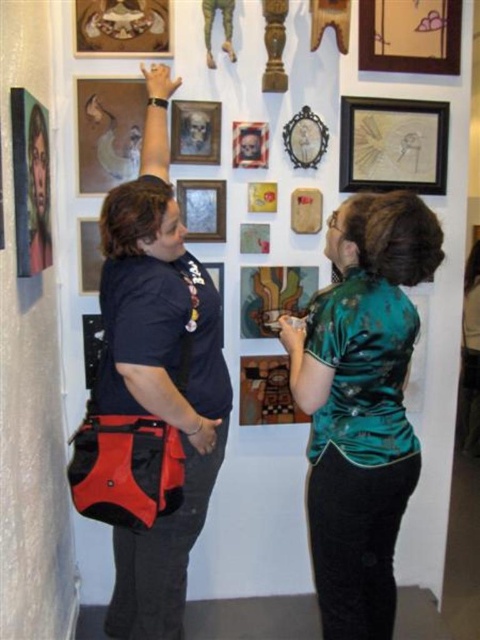
You are a tour guide leading a group through an art gallery. You notice two items in the scene described above. One is the matte black shirt at upper left and the other is the wooden picture frame at upper center. Your group asks if there is enough space between these two items for a small 18 inch wide sculpture. Can you confirm?

The matte black shirt at upper left and wooden picture frame at upper center are 20.54 inches apart from each other. Since the sculpture is 18 inches wide, there is enough space between them to accommodate it.

You are an art curator trying to arrange two new frames on the wall. You have a matte black picture frame at upper center and a wooden picture frame at upper right. According to the current layout, where should you place the new frames to maintain the existing arrangement?

The matte black picture frame at upper center should be placed on the left side of the wooden picture frame at upper right to maintain the existing arrangement.

You are an art curator planning to install a new sculpture that requires a minimum of 1.2 meters of space between it and the nearest artwork. You have two options for placement near the matte glass painting at center and the matte black picture frame at upper left. Based on their sizes, which artwork would allow sufficient space if the sculpture is placed adjacent to it?

The matte glass painting at center might be wider than the matte black picture frame at upper left, so placing the sculpture next to the narrower matte black picture frame at upper left would provide the required 1.2 meters of space if the frame is smaller. However, without exact measurements, this is an approximation based on the given information.